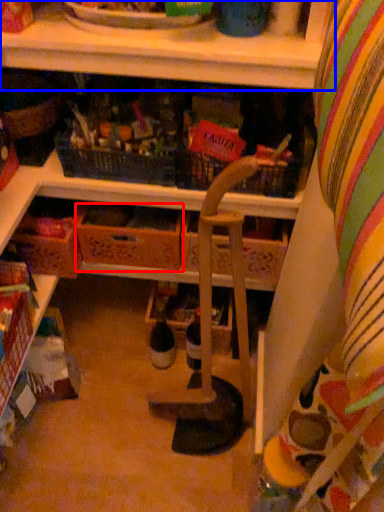
Question: Among these objects, which one is farthest to the camera, drawer (highlighted by a red box) or shelf (highlighted by a blue box)?

Choices:
 (A) drawer
 (B) shelf

Answer: (A)